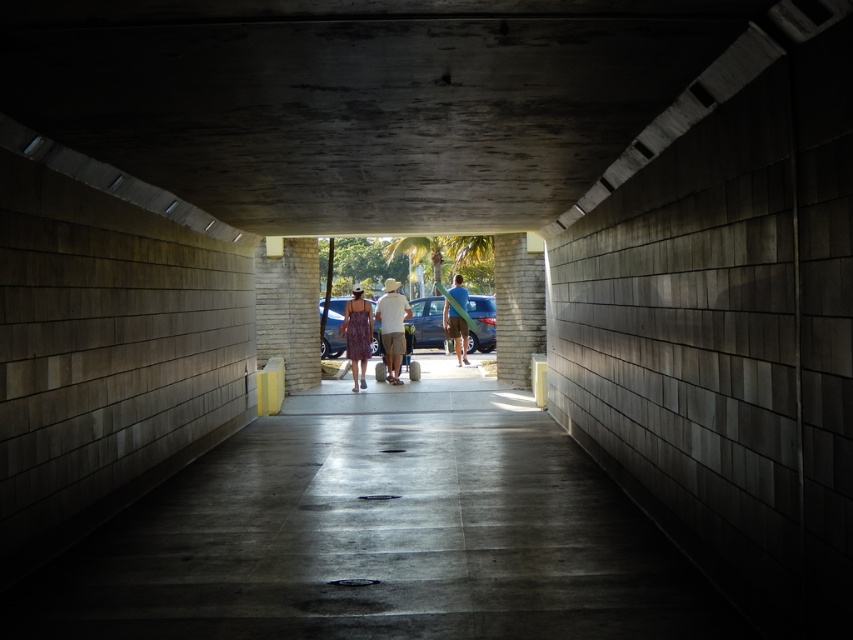
Is point (262, 561) positioned in front of point (393, 316)?

That is True.

Can you confirm if concrete at center is positioned to the right of matte white shirt at center?

Indeed, concrete at center is positioned on the right side of matte white shirt at center.

Who is more distant from viewer, (132,577) or (383,314)?

The point (383,314) is behind.

Identify the location of concrete at center. Image resolution: width=853 pixels, height=640 pixels. (380, 532).

Does concrete at center appear over metallic blue car at center?

No.

Who is shorter, concrete at center or metallic blue car at center?

concrete at center is shorter.

I want to click on concrete at center, so click(x=380, y=532).

This screenshot has width=853, height=640. I want to click on concrete at center, so click(x=380, y=532).

Find the location of a particular element. matte white shirt at center is located at coordinates (392, 326).

Is point (393, 376) closer to viewer compared to point (341, 326)?

That is False.

This screenshot has width=853, height=640. I want to click on matte white shirt at center, so click(392, 326).